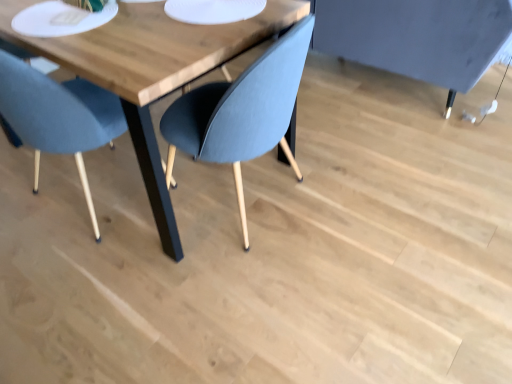
The height and width of the screenshot is (384, 512). Identify the location of free space on the front side of wooden table at center. (161, 301).